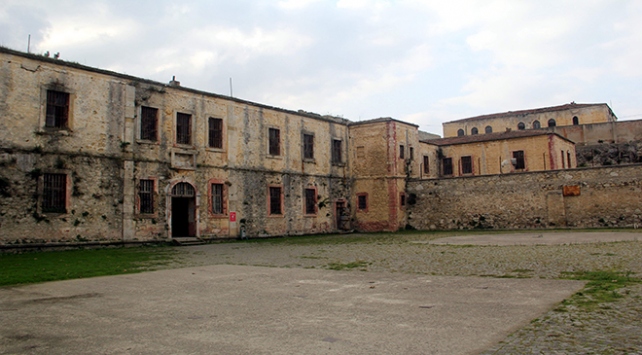
You are a GUI agent. You are given a task and a screenshot of the screen. Output one action in this format:
    pyautogui.click(x=<x>, y=<y>)
    Task: Click on the window
    This screenshot has height=355, width=642.
    Given the screenshot: What is the action you would take?
    pyautogui.click(x=135, y=127)